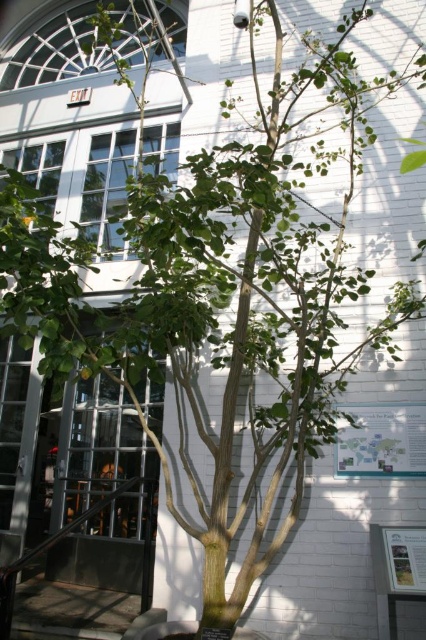
Question: Can you confirm if green paper map at center is smaller than white paperboard at lower right?

Choices:
 (A) no
 (B) yes

Answer: (A)

Question: Which of the following is the farthest from the observer?

Choices:
 (A) (388, 419)
 (B) (146, 544)

Answer: (A)

Question: Does green paper map at center have a greater width compared to metallic glass door at center?

Choices:
 (A) yes
 (B) no

Answer: (B)

Question: Which of the following is the farthest from the observer?

Choices:
 (A) (423, 588)
 (B) (0, 595)

Answer: (A)

Question: Which is farther from the metallic glass door at center?

Choices:
 (A) green paper map at center
 (B) white paperboard at lower right

Answer: (B)

Question: Is green paper map at center above white paperboard at lower right?

Choices:
 (A) yes
 (B) no

Answer: (A)